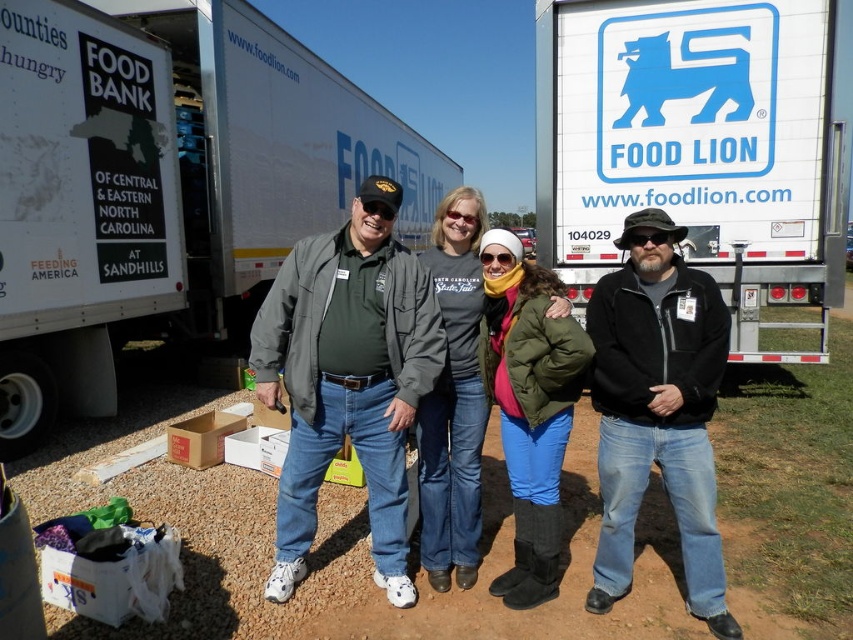
Question: Can you confirm if green puffy jacket at center is thinner than black matte goggles at center?

Choices:
 (A) yes
 (B) no

Answer: (B)

Question: Which object appears farthest from the camera in this image?

Choices:
 (A) white matte truck at right
 (B) black fleece jacket at center
 (C) matte gray jacket at center
 (D) green puffy jacket at center

Answer: (A)

Question: Among these objects, which one is nearest to the camera?

Choices:
 (A) brown cardboard box at center
 (B) green puffy jacket at center

Answer: (B)

Question: Can you confirm if matte gray jacket at center is thinner than green puffy jacket at center?

Choices:
 (A) yes
 (B) no

Answer: (B)

Question: Which point is farther to the camera?

Choices:
 (A) (676, 376)
 (B) (42, 220)

Answer: (B)

Question: Observing the image, what is the correct spatial positioning of matte gray jacket at center in reference to brown cardboard box at center?

Choices:
 (A) below
 (B) above

Answer: (B)